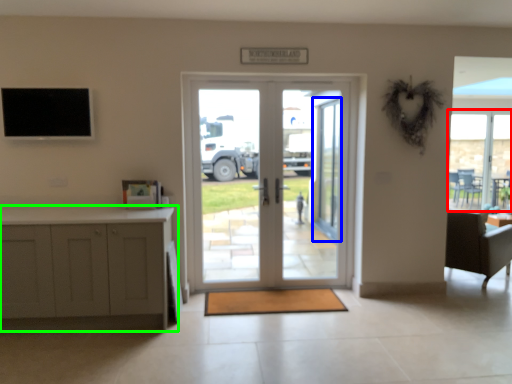
Question: Considering the real-world distances, which object is closest to window (highlighted by a red box)? screen door (highlighted by a blue box) or cabinetry (highlighted by a green box).

Choices:
 (A) screen door
 (B) cabinetry

Answer: (A)